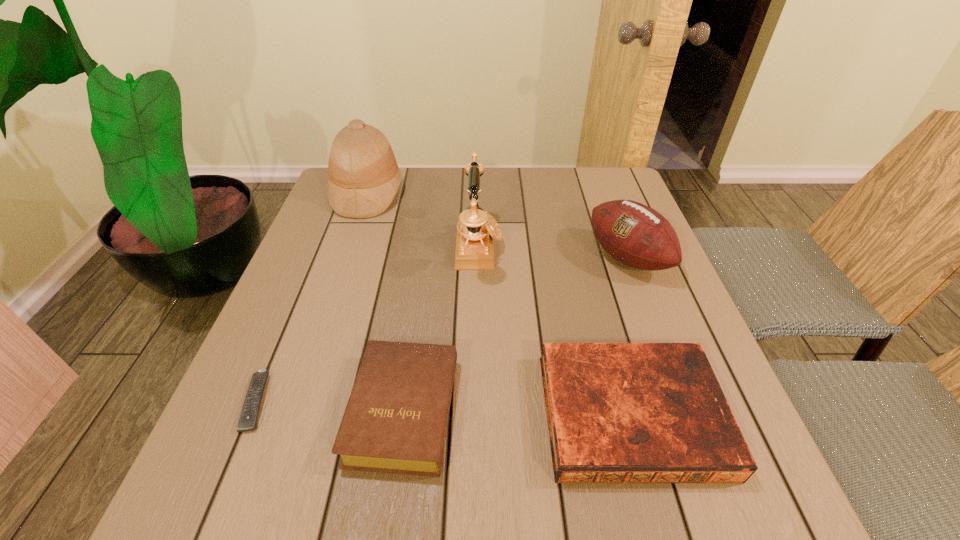
Locate an element on the screen. blank space located on the spine side of the right Bible is located at coordinates (660, 519).

At what (x,y) coordinates should I click in order to perform the action: click on free location located 0.180m on the back of the remote control. Please return your answer as a coordinate pair (x, y). Looking at the image, I should click on [x=298, y=303].

Locate an element on the screen. object at the far edge is located at coordinates (364, 177).

Locate an element on the screen. hat located in the left edge section of the desktop is located at coordinates (364, 177).

Locate an element on the screen. This screenshot has height=540, width=960. remote control that is positioned at the left edge is located at coordinates pyautogui.click(x=247, y=422).

Locate an element on the screen. The image size is (960, 540). football (American) situated at the right edge is located at coordinates (634, 234).

What are the coordinates of `Bible at the right edge` in the screenshot? It's located at (617, 412).

Where is `object present at the far left corner`? Image resolution: width=960 pixels, height=540 pixels. object present at the far left corner is located at coordinates (364, 177).

The height and width of the screenshot is (540, 960). Identify the location of object present at the near right corner. (617, 412).

In the image, there is a desktop. Where is `free space at the far edge`? free space at the far edge is located at coordinates (503, 182).